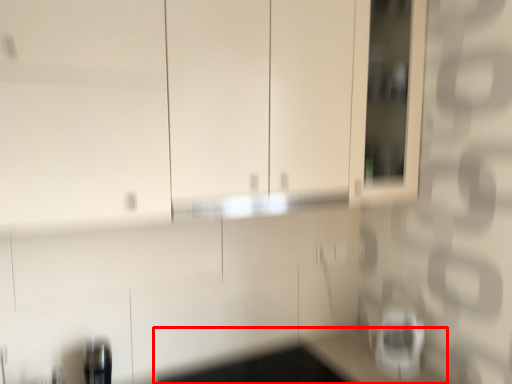
Question: Considering the relative positions of counter top (annotated by the red box) and appliance in the image provided, where is counter top (annotated by the red box) located with respect to the staircase?

Choices:
 (A) left
 (B) right

Answer: (A)